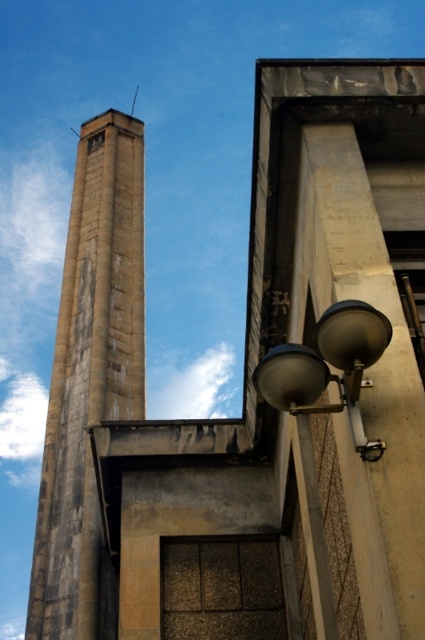
Measure the distance between concrete tower at left and satin silver lamp at lower right.

A distance of 99.01 feet exists between concrete tower at left and satin silver lamp at lower right.

Is concrete tower at left positioned at the back of satin silver lamp at lower right?

Yes, concrete tower at left is further from the viewer.

Is point (51, 630) positioned before point (309, 396)?

No, (51, 630) is further to viewer.

Where is `concrete tower at left`? The height and width of the screenshot is (640, 425). concrete tower at left is located at coordinates (90, 374).